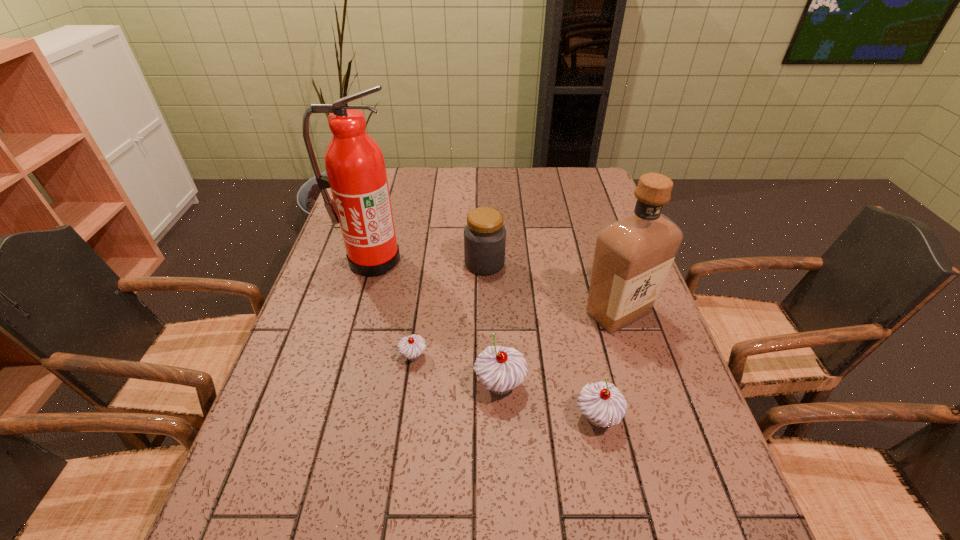
At what (x,y) coordinates should I click in order to perform the action: click on the leftmost cupcake. Please return your answer as a coordinate pair (x, y). The height and width of the screenshot is (540, 960). Looking at the image, I should click on (411, 347).

Locate an element on the screen. the shortest object is located at coordinates (411, 347).

The image size is (960, 540). I want to click on the second cupcake from left to right, so click(500, 369).

The height and width of the screenshot is (540, 960). Identify the location of the rightmost cupcake. (603, 404).

The height and width of the screenshot is (540, 960). I want to click on liquor, so click(633, 255).

Where is `the third farthest object`? Image resolution: width=960 pixels, height=540 pixels. the third farthest object is located at coordinates (633, 255).

Locate an element on the screen. jar is located at coordinates (484, 235).

This screenshot has height=540, width=960. I want to click on the leftmost object, so click(x=356, y=173).

Where is `fire extinguisher`? fire extinguisher is located at coordinates (356, 173).

The width and height of the screenshot is (960, 540). In order to click on free spot located 0.070m on the back of the shortest object in this screenshot , I will do `click(418, 323)`.